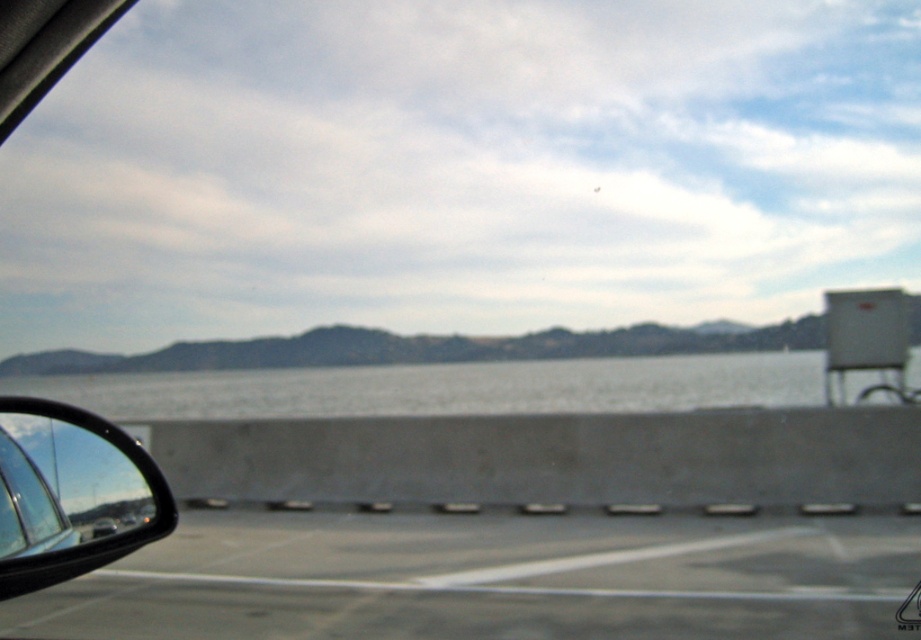
Is point (136, 602) farther from viewer compared to point (631, 392)?

No, (136, 602) is closer to viewer.

Is point (577, 538) positioned behind point (713, 378)?

That is False.

Identify the location of gray asphalt highway at lower left. Image resolution: width=921 pixels, height=640 pixels. (491, 579).

Which of these two, gray asphalt highway at lower left or black glossy side mirror at lower left, stands shorter?

Standing shorter between the two is gray asphalt highway at lower left.

What do you see at coordinates (491, 579) in the screenshot? I see `gray asphalt highway at lower left` at bounding box center [491, 579].

Is point (383, 577) positioned in front of point (138, 486)?

No, it is behind (138, 486).

This screenshot has height=640, width=921. I want to click on gray asphalt highway at lower left, so click(491, 579).

Can you confirm if gray concrete water at center is wider than black glossy side mirror at lower left?

Correct, the width of gray concrete water at center exceeds that of black glossy side mirror at lower left.

Is gray concrete water at center further to the viewer compared to black glossy side mirror at lower left?

That is True.

Which is behind, point (917, 369) or point (59, 512)?

The point (917, 369) is behind.

Identify the location of gray concrete water at center. The height and width of the screenshot is (640, 921). (447, 387).